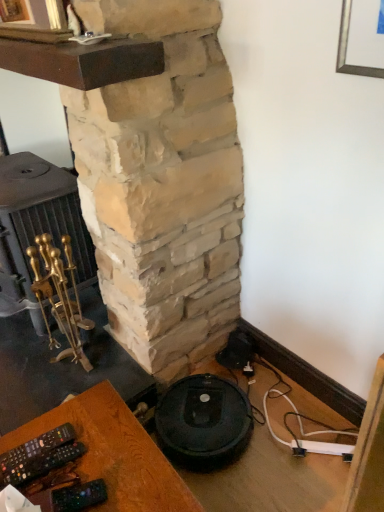
Question: Considering the relative positions of gold polished fireplace tools at left and black plastic remote control at lower left in the image provided, is gold polished fireplace tools at left to the left of black plastic remote control at lower left from the viewer's perspective?

Choices:
 (A) yes
 (B) no

Answer: (A)

Question: Is gold polished fireplace tools at left positioned in front of black plastic remote control at lower left?

Choices:
 (A) no
 (B) yes

Answer: (A)

Question: Is gold polished fireplace tools at left smaller than black plastic remote control at lower left?

Choices:
 (A) yes
 (B) no

Answer: (A)

Question: Can you confirm if gold polished fireplace tools at left is shorter than black plastic remote control at lower left?

Choices:
 (A) yes
 (B) no

Answer: (B)

Question: Does gold polished fireplace tools at left have a larger size compared to black plastic remote control at lower left?

Choices:
 (A) yes
 (B) no

Answer: (B)

Question: From the image's perspective, relative to gold polished fireplace tools at left, is black plastic remote control at lower left above or below?

Choices:
 (A) below
 (B) above

Answer: (A)

Question: Would you say black plastic remote control at lower left is to the left or to the right of gold polished fireplace tools at left in the picture?

Choices:
 (A) right
 (B) left

Answer: (A)

Question: Is black plastic remote control at lower left in front of or behind gold polished fireplace tools at left in the image?

Choices:
 (A) front
 (B) behind

Answer: (A)

Question: Is black plastic remote control at lower left situated inside gold polished fireplace tools at left or outside?

Choices:
 (A) outside
 (B) inside

Answer: (A)

Question: Considering the positions of black plastic remote control at lower left and natural stone fireplace at center in the image, is black plastic remote control at lower left wider or thinner than natural stone fireplace at center?

Choices:
 (A) thin
 (B) wide

Answer: (A)

Question: Does point (23, 431) appear closer or farther from the camera than point (195, 203)?

Choices:
 (A) closer
 (B) farther

Answer: (A)

Question: Is black plastic remote control at lower left situated inside natural stone fireplace at center or outside?

Choices:
 (A) outside
 (B) inside

Answer: (A)

Question: Considering their positions, is black plastic remote control at lower left located in front of or behind natural stone fireplace at center?

Choices:
 (A) behind
 (B) front

Answer: (A)

Question: Which is correct: natural stone fireplace at center is inside black plastic remote control at lower left, or outside of it?

Choices:
 (A) outside
 (B) inside

Answer: (A)

Question: Is natural stone fireplace at center to the left or to the right of black plastic remote control at lower left in the image?

Choices:
 (A) left
 (B) right

Answer: (A)